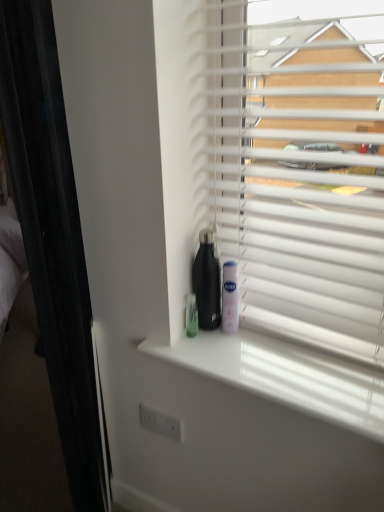
Question: Does white plastic blinds at upper right have a lesser height compared to white plastic mouthwash at center?

Choices:
 (A) yes
 (B) no

Answer: (B)

Question: Considering the relative sizes of white plastic blinds at upper right and white plastic mouthwash at center in the image provided, is white plastic blinds at upper right wider than white plastic mouthwash at center?

Choices:
 (A) yes
 (B) no

Answer: (A)

Question: From a real-world perspective, is white plastic blinds at upper right on white plastic mouthwash at center?

Choices:
 (A) no
 (B) yes

Answer: (B)

Question: Are white plastic blinds at upper right and white plastic mouthwash at center beside each other?

Choices:
 (A) no
 (B) yes

Answer: (A)

Question: Can you confirm if white plastic blinds at upper right is bigger than white plastic mouthwash at center?

Choices:
 (A) no
 (B) yes

Answer: (B)

Question: From a real-world perspective, is white glossy window sill at center physically located above or below white plastic blinds at upper right?

Choices:
 (A) above
 (B) below

Answer: (B)

Question: Is point (304, 381) closer or farther from the camera than point (253, 128)?

Choices:
 (A) closer
 (B) farther

Answer: (A)

Question: Based on their positions, is white glossy window sill at center located to the left or right of white plastic blinds at upper right?

Choices:
 (A) right
 (B) left

Answer: (B)

Question: Is white glossy window sill at center bigger or smaller than white plastic blinds at upper right?

Choices:
 (A) small
 (B) big

Answer: (A)

Question: Is white plastic mouthwash at center inside or outside of black matte water bottle at center?

Choices:
 (A) inside
 (B) outside

Answer: (B)

Question: Relative to black matte water bottle at center, is white plastic mouthwash at center in front or behind?

Choices:
 (A) front
 (B) behind

Answer: (B)

Question: From the image's perspective, is white plastic mouthwash at center above or below black matte water bottle at center?

Choices:
 (A) above
 (B) below

Answer: (B)

Question: Considering the relative positions of white plastic mouthwash at center and black matte water bottle at center in the image provided, is white plastic mouthwash at center to the left or to the right of black matte water bottle at center?

Choices:
 (A) left
 (B) right

Answer: (B)

Question: From a real-world perspective, is white plastic blinds at upper right above or below white plastic mouthwash at center?

Choices:
 (A) above
 (B) below

Answer: (A)

Question: Is point (178, 196) positioned closer to the camera than point (236, 297)?

Choices:
 (A) farther
 (B) closer

Answer: (B)